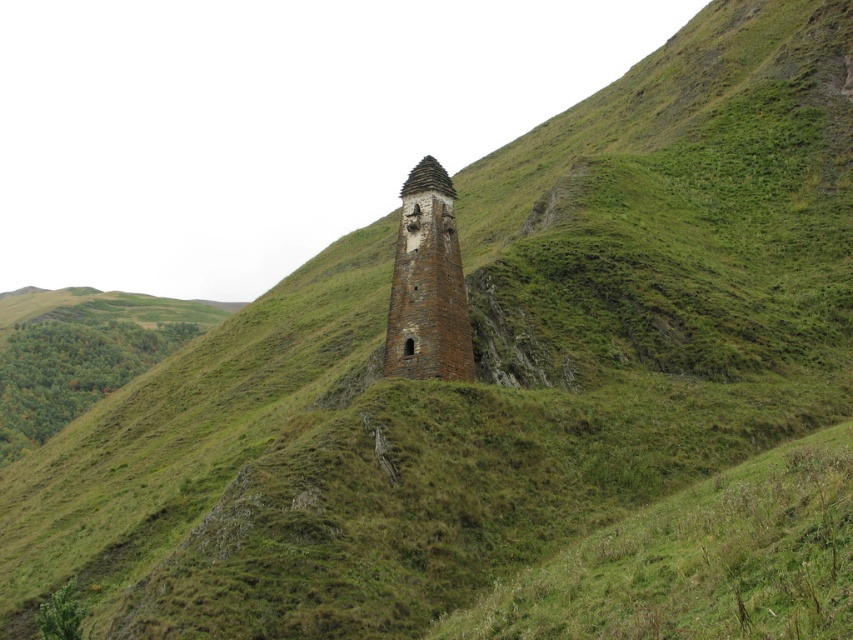
Question: Which point appears farthest from the camera in this image?

Choices:
 (A) (438, 316)
 (B) (451, 193)

Answer: (B)

Question: Among these objects, which one is nearest to the camera?

Choices:
 (A) brown brick tower at center
 (B) brown stone tower at center

Answer: (B)

Question: Does brown stone tower at center appear on the right side of brown brick tower at center?

Choices:
 (A) yes
 (B) no

Answer: (B)

Question: Can you confirm if brown stone tower at center is positioned below brown brick tower at center?

Choices:
 (A) yes
 (B) no

Answer: (A)

Question: Can you confirm if brown stone tower at center is smaller than brown brick tower at center?

Choices:
 (A) no
 (B) yes

Answer: (A)

Question: Which of the following is the farthest from the observer?

Choices:
 (A) click(x=447, y=324)
 (B) click(x=440, y=179)

Answer: (B)